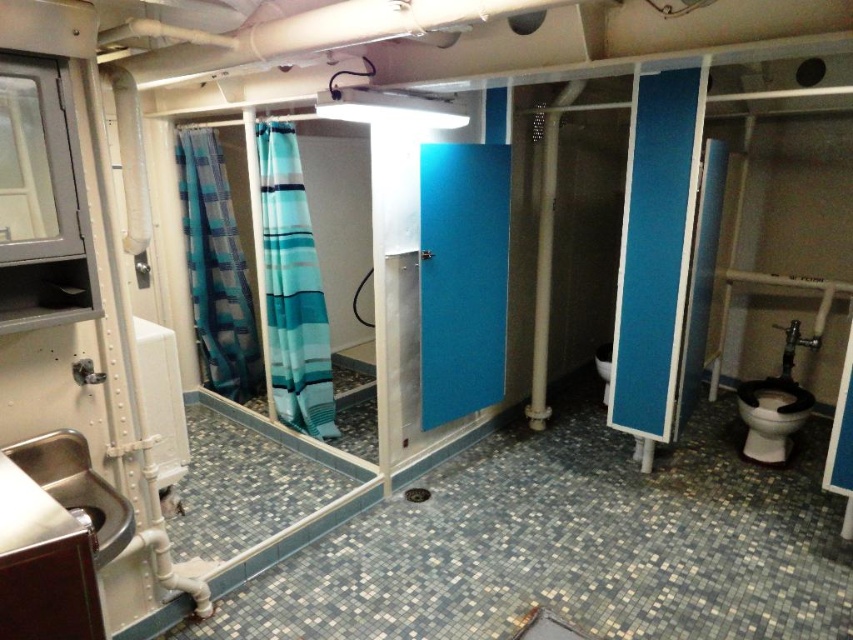
You are standing in the bathroom and want to reach both points. Which point, point (474,163) or point (213,211), is closer to you?

Point (474,163) is closer to the viewer than point (213,211).

You are a guest in this bathroom and need to locate both the blue striped fabric at left and the black glossy toilet bowl at lower right. From your current position facing the bathroom entrance, which object is closer to the left wall?

The blue striped fabric at left is closer to the left wall since it is positioned to the left of the black glossy toilet bowl at lower right.

You are a guest in this bathroom and need to enter the shower area. The blue striped fabric at left is the shower curtain. Is the blue matte door at center blocking your path to the shower curtain?

The blue matte door at center is in front of the blue striped fabric at left, so yes, the blue matte door at center is blocking the path to the shower curtain.